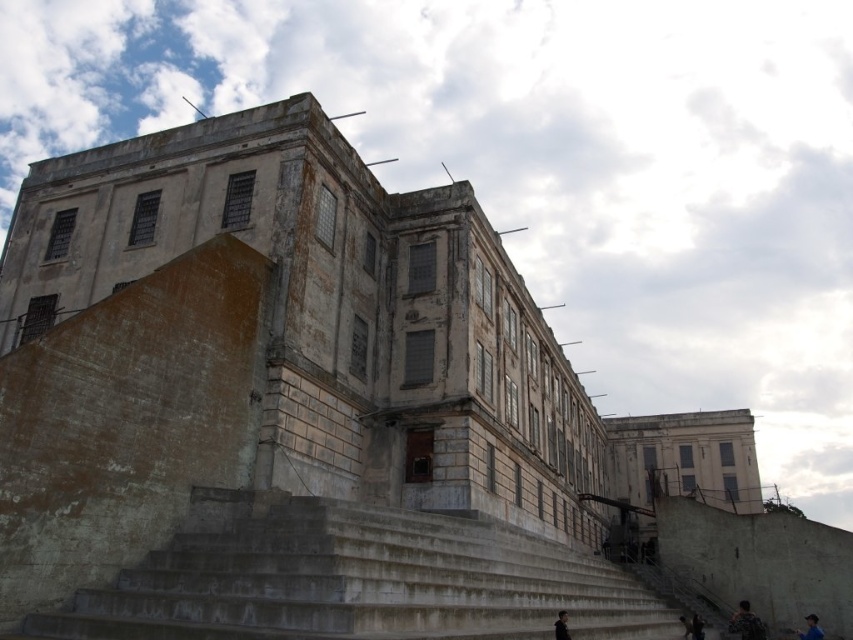
Does point (756, 624) come farther from viewer compared to point (697, 630)?

No, (756, 624) is in front of (697, 630).

Where is `dark blue fabric jacket at lower right`? Image resolution: width=853 pixels, height=640 pixels. dark blue fabric jacket at lower right is located at coordinates (746, 621).

What do you see at coordinates (746, 621) in the screenshot?
I see `dark blue fabric jacket at lower right` at bounding box center [746, 621].

Find the location of a particular element. dark blue fabric jacket at lower right is located at coordinates (746, 621).

Who is positioned more to the left, dark hair at lower right or dark gray concrete person at lower center?

dark gray concrete person at lower center is more to the left.

Is dark hair at lower right smaller than dark gray concrete person at lower center?

No.

Image resolution: width=853 pixels, height=640 pixels. Describe the element at coordinates (692, 627) in the screenshot. I see `dark hair at lower right` at that location.

Locate an element on the screen. dark hair at lower right is located at coordinates (692, 627).

Who is higher up, concrete stairs at center or blue fabric person at lower right?

Positioned higher is concrete stairs at center.

Looking at this image, can you confirm if concrete stairs at center is taller than blue fabric person at lower right?

Indeed, concrete stairs at center has a greater height compared to blue fabric person at lower right.

Is point (543, 616) farther from camera compared to point (804, 636)?

No.

The height and width of the screenshot is (640, 853). What are the coordinates of `concrete stairs at center` in the screenshot? It's located at (355, 579).